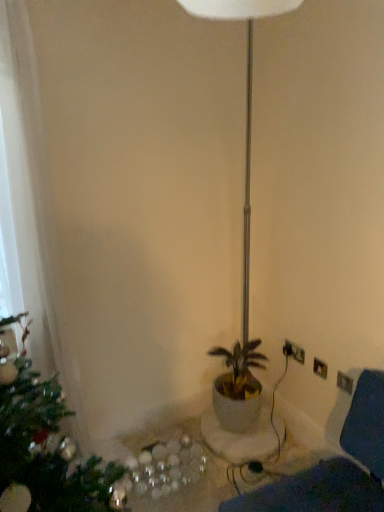
This screenshot has width=384, height=512. I want to click on free space above white glossy table at lower center (from a real-world perspective), so click(x=222, y=465).